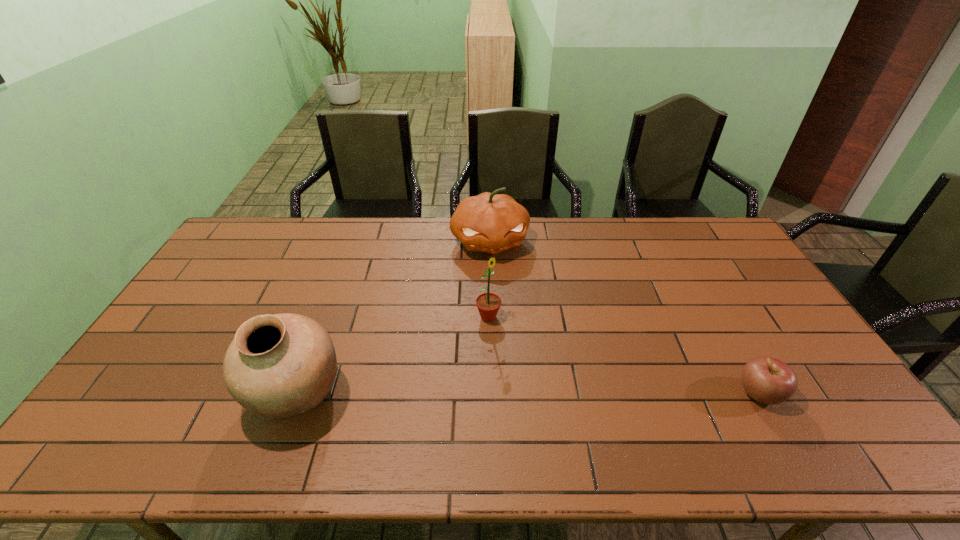
This screenshot has height=540, width=960. What are the coordinates of `blank space at the right edge of the desktop` in the screenshot? It's located at (717, 263).

Locate an element on the screen. The height and width of the screenshot is (540, 960). vacant area at the near left corner is located at coordinates (153, 409).

Locate an element on the screen. Image resolution: width=960 pixels, height=540 pixels. blank space at the far right corner of the desktop is located at coordinates (723, 245).

At what (x,y) coordinates should I click in order to perform the action: click on vacant space in between the apple and the leftmost object. Please return your answer as a coordinate pair (x, y). Looking at the image, I should click on (528, 393).

Locate an element on the screen. This screenshot has height=540, width=960. vacant space in between the rightmost object and the pumpkin is located at coordinates (625, 317).

The image size is (960, 540). Find the location of `vacant space that's between the rightmost object and the pottery`. vacant space that's between the rightmost object and the pottery is located at coordinates (528, 393).

This screenshot has width=960, height=540. I want to click on free space between the farthest object and the leftmost object, so click(x=393, y=318).

Where is `free space between the pumpkin and the pottery`? free space between the pumpkin and the pottery is located at coordinates (393, 318).

Locate an element on the screen. unoccupied position between the second farthest object and the pottery is located at coordinates (393, 355).

At what (x,y) coordinates should I click in order to perform the action: click on vacant area between the pumpkin and the pottery. Please return your answer as a coordinate pair (x, y). Looking at the image, I should click on [393, 318].